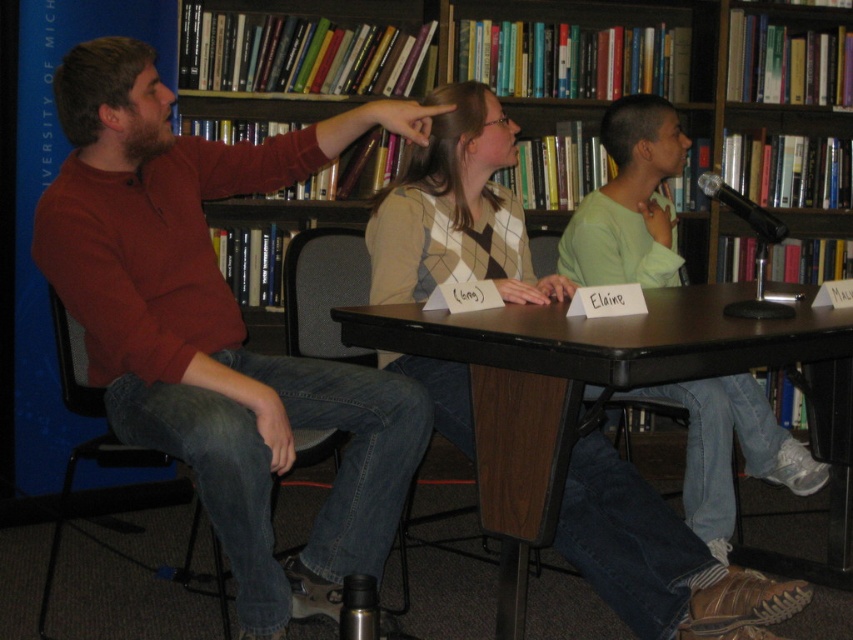
In the scene shown: Which of these two, matte red sweater at left or wooden bookshelf at upper center, stands taller?

With more height is matte red sweater at left.

Is point (57, 118) closer to viewer compared to point (780, 26)?

Yes, it is.

Who is more forward, (x=397, y=102) or (x=347, y=19)?

Point (x=397, y=102)

This screenshot has width=853, height=640. Find the location of `matte red sweater at left`. matte red sweater at left is located at coordinates (218, 328).

Is point (389, 458) closer to camera compared to point (584, 221)?

Yes, point (389, 458) is in front of point (584, 221).

Does matte red sweater at left appear under light green shirt at center?

Yes.

Does point (65, 99) come closer to viewer compared to point (724, 420)?

Yes.

The width and height of the screenshot is (853, 640). I want to click on matte red sweater at left, so click(x=218, y=328).

Between matte red sweater at left and black plastic chair at left, which one appears on the left side from the viewer's perspective?

black plastic chair at left

The image size is (853, 640). Identify the location of matte red sweater at left. (218, 328).

Locate an element on the screen. This screenshot has height=640, width=853. matte red sweater at left is located at coordinates (218, 328).